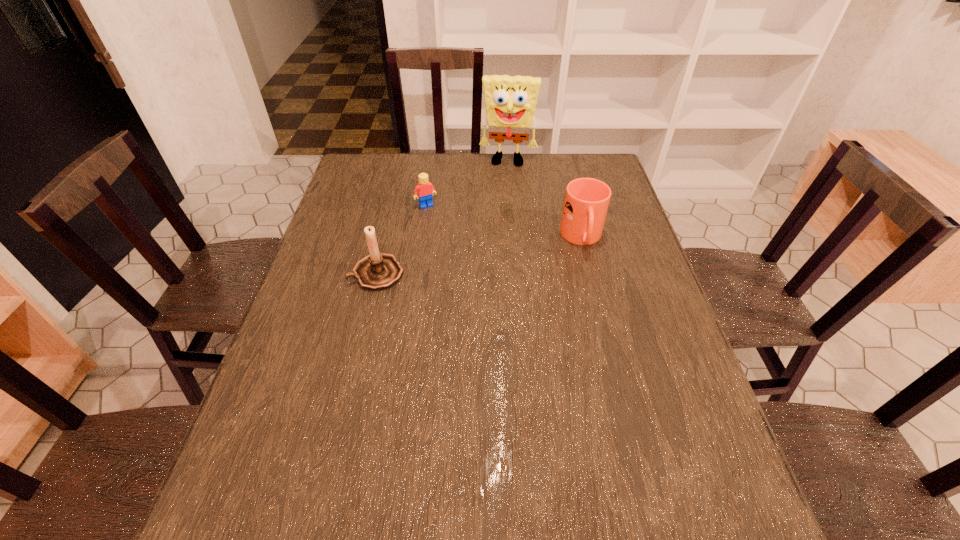
This screenshot has height=540, width=960. In order to click on vacant space located on the face of the Lego in this screenshot , I will do `click(473, 279)`.

This screenshot has height=540, width=960. Find the location of `vacant space located on the face of the sponge`. vacant space located on the face of the sponge is located at coordinates (505, 179).

Locate an element on the screen. The image size is (960, 540). free space located 0.100m on the face of the sponge is located at coordinates (504, 186).

Where is `vacant space positioned on the face of the sponge`? The image size is (960, 540). vacant space positioned on the face of the sponge is located at coordinates (505, 178).

This screenshot has width=960, height=540. I want to click on object present at the far edge, so click(510, 101).

Where is `object located in the left edge section of the desktop`? Image resolution: width=960 pixels, height=540 pixels. object located in the left edge section of the desktop is located at coordinates coord(378,271).

Image resolution: width=960 pixels, height=540 pixels. I want to click on object situated at the right edge, so click(x=586, y=202).

Identify the location of free space at the far edge of the desktop. The width and height of the screenshot is (960, 540). (x=466, y=173).

Where is `vacant space at the near edge of the desktop`? Image resolution: width=960 pixels, height=540 pixels. vacant space at the near edge of the desktop is located at coordinates (467, 469).

The width and height of the screenshot is (960, 540). In the image, there is a desktop. Find the location of `vacant space at the left edge`. vacant space at the left edge is located at coordinates (368, 222).